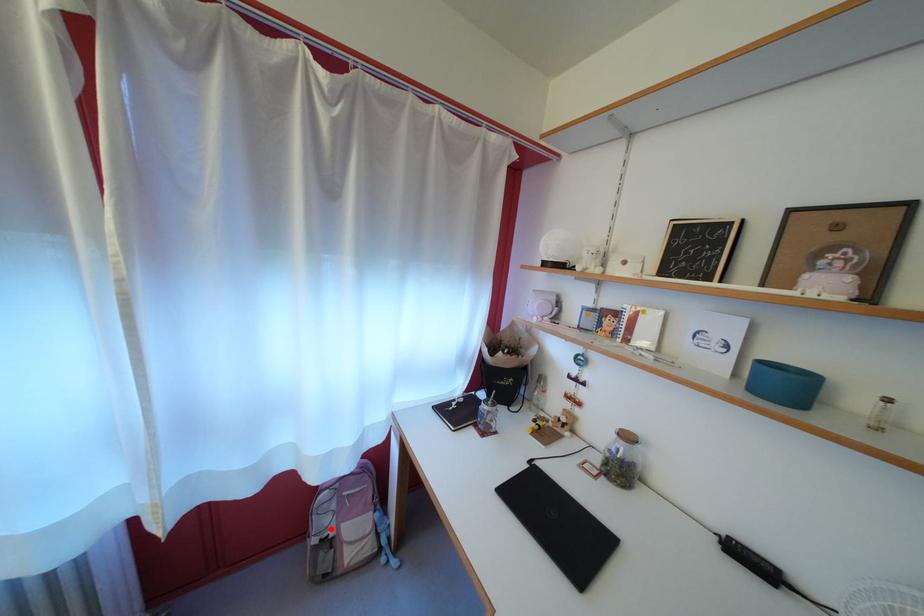
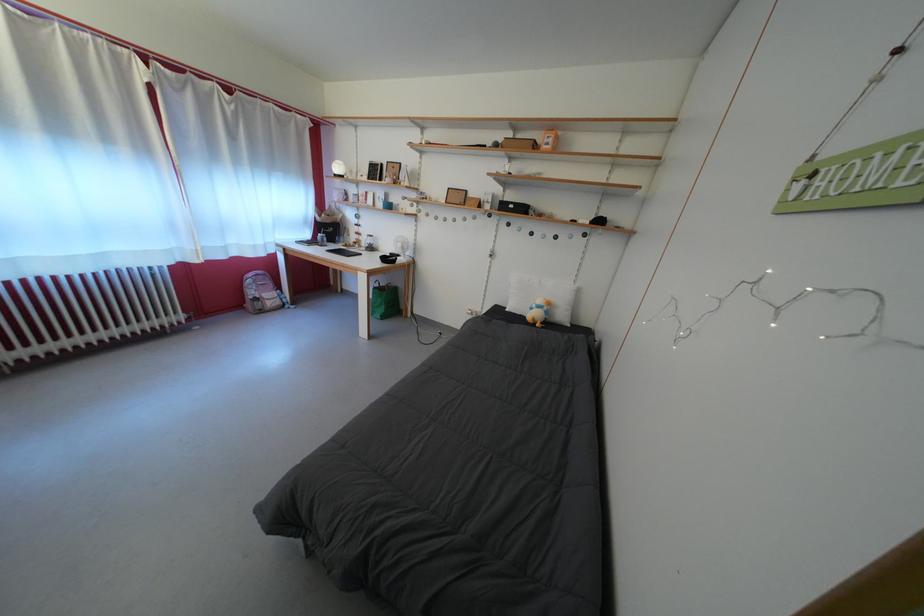
Question: A red point is marked in image1. In image2, is the corresponding 3D point closer to the camera or farther? Reply with the corresponding letter.

Choices:
 (A) The corresponding 3D point is closer.
 (B) The corresponding 3D point is farther.

Answer: (A)